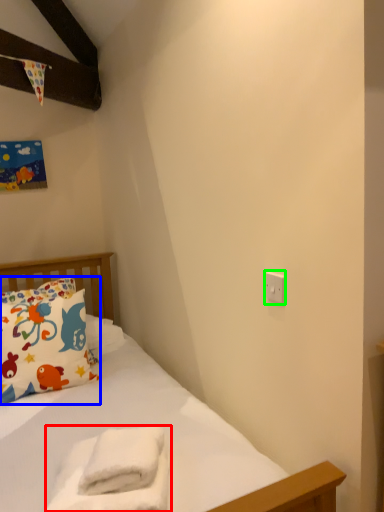
Question: Which object is the closest to the material (highlighted by a red box)? Choose among these: pillow (highlighted by a blue box) or electric outlet (highlighted by a green box).

Choices:
 (A) pillow
 (B) electric outlet

Answer: (B)